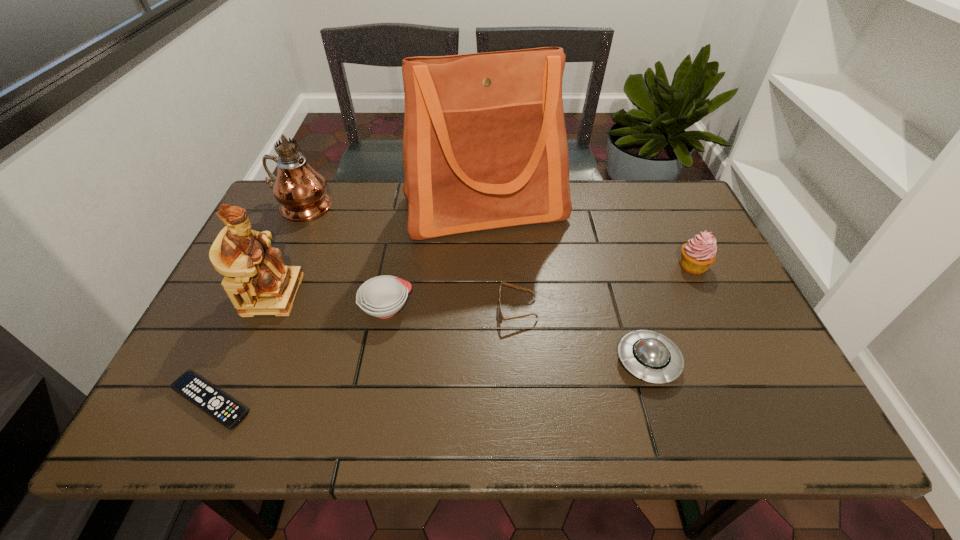
In the image, there is a desktop. At what (x,y) coordinates should I click in order to perform the action: click on vacant area at the right edge. Please return your answer as a coordinate pair (x, y). This screenshot has width=960, height=540. Looking at the image, I should click on (732, 377).

In the image, there is a desktop. In order to click on vacant space at the far right corner in this screenshot , I will do `click(688, 204)`.

What are the coordinates of `vacant point located between the soup bowl and the seventh tallest object` in the screenshot? It's located at (452, 308).

Find the location of a particular element. This screenshot has height=540, width=960. vacant area that lies between the soup bowl and the saucer is located at coordinates (517, 335).

Where is `empty space that is in between the third tallest object and the soup bowl`? empty space that is in between the third tallest object and the soup bowl is located at coordinates (330, 301).

At what (x,y) coordinates should I click in order to perform the action: click on vacant area that lies between the figurine and the oil lamp. Please return your answer as a coordinate pair (x, y). This screenshot has width=960, height=540. Looking at the image, I should click on (286, 251).

Image resolution: width=960 pixels, height=540 pixels. In order to click on free spot between the rightmost object and the soup bowl in this screenshot , I will do `click(540, 287)`.

Find the location of `free spot between the third tallest object and the shopping bag`. free spot between the third tallest object and the shopping bag is located at coordinates (379, 252).

Find the location of a particular element. empty space between the remote control and the rightmost object is located at coordinates (452, 334).

Select which object is the third closest to the figurine. Please provide its 2D coordinates. Your answer should be formatted as a tuple, i.e. [(x, y)], where the tuple contains the x and y coordinates of a point satisfying the conditions above.

[(301, 191)]